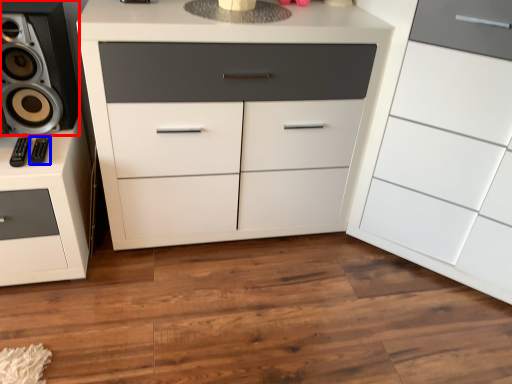
Question: Which object appears closest to the camera in this image, speaker (highlighted by a red box) or audio (highlighted by a blue box)?

Choices:
 (A) speaker
 (B) audio

Answer: (A)